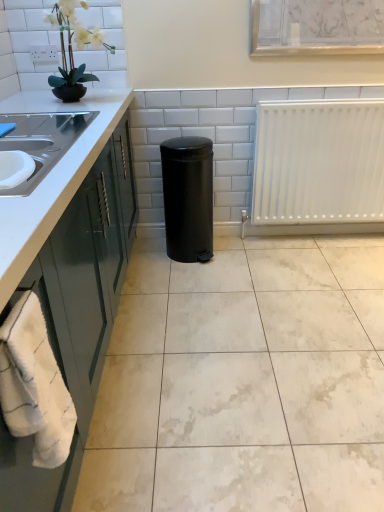
Question: Considering the relative positions of matte black pot at upper left and white matte radiator at right in the image provided, is matte black pot at upper left to the left or to the right of white matte radiator at right?

Choices:
 (A) left
 (B) right

Answer: (A)

Question: In terms of size, does matte black pot at upper left appear bigger or smaller than white matte radiator at right?

Choices:
 (A) small
 (B) big

Answer: (A)

Question: Considering the real-world distances, which object is farthest from the white fluffy bath towel at lower left?

Choices:
 (A) matte black pot at upper left
 (B) white glossy countertop at left
 (C) black matte trash can at center
 (D) white glossy tile at center
 (E) white matte radiator at right

Answer: (E)

Question: Which is nearer to the matte black pot at upper left?

Choices:
 (A) white fluffy bath towel at lower left
 (B) white glossy tile at center
 (C) white matte radiator at right
 (D) black matte trash can at center
 (E) white glossy countertop at left

Answer: (E)